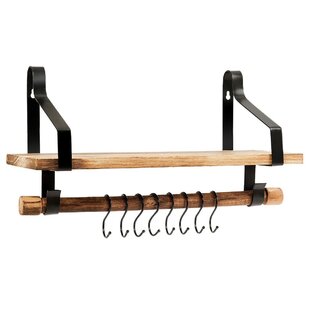
You are a GUI agent. You are given a task and a screenshot of the screen. Output one action in this format:
    pyautogui.click(x=<x>, y=<y>)
    Task: Click on the 9th black hook
    
    Given the screenshot: What is the action you would take?
    pyautogui.click(x=212, y=230)